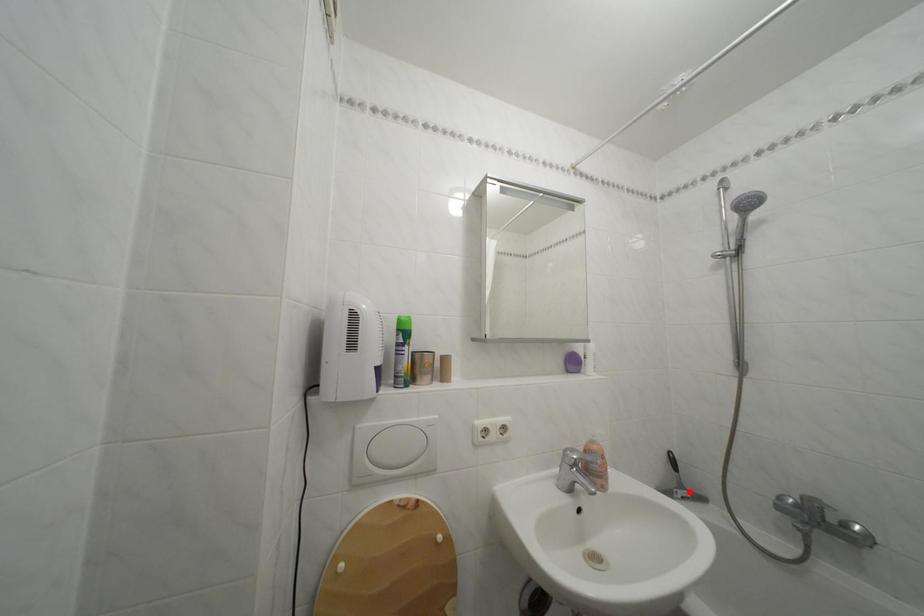
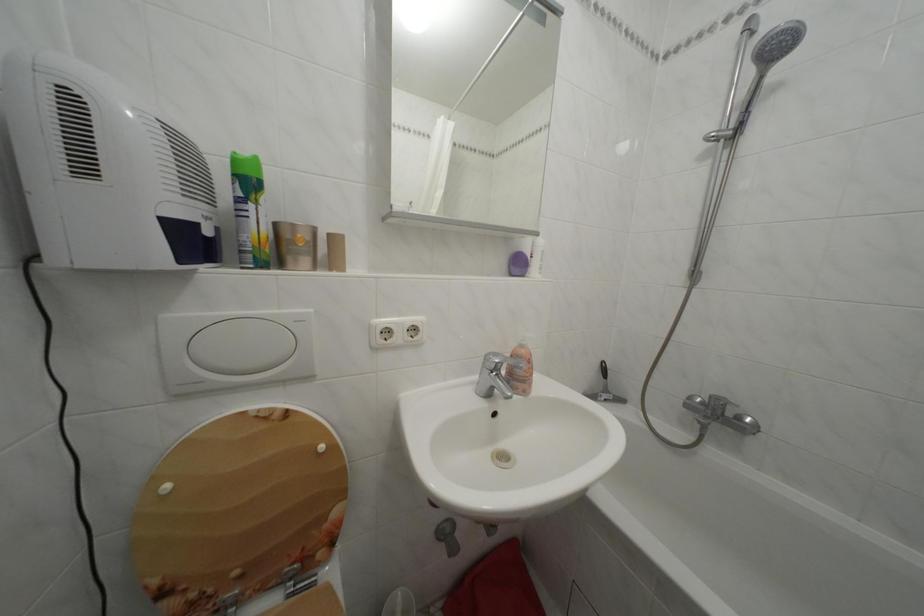
Question: I am providing you with two images of the same scene from different viewpoints. Image1 has a red point marked. In image2, the corresponding 3D location appears at what relative position? Reply with the corresponding letter.

Choices:
 (A) Closer
 (B) Farther

Answer: (B)